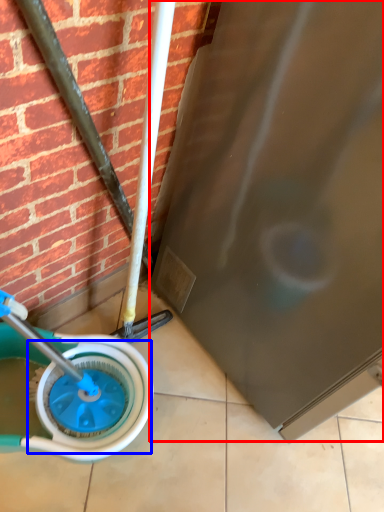
Question: Among these objects, which one is farthest to the camera, screen door (highlighted by a red box) or wheel (highlighted by a blue box)?

Choices:
 (A) screen door
 (B) wheel

Answer: (B)